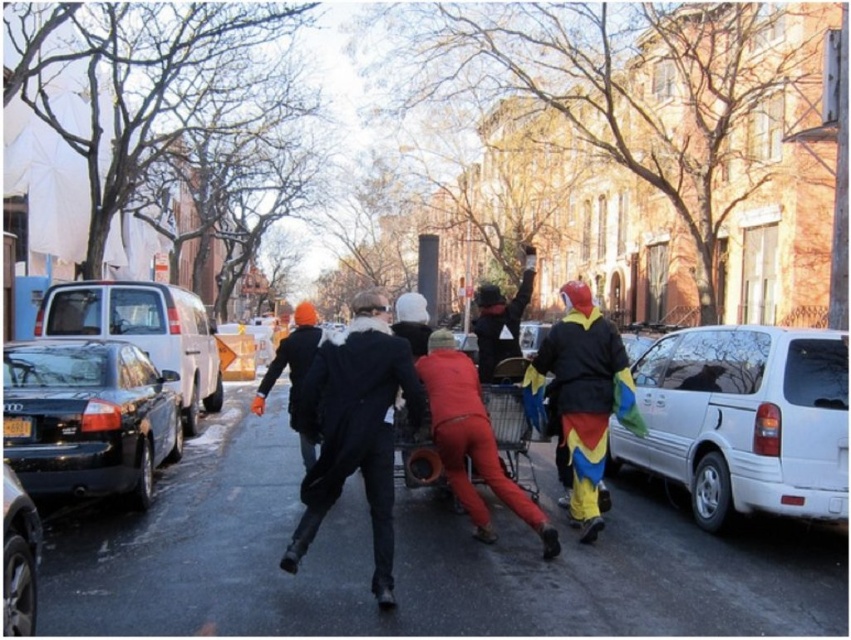
Which of these two, shiny black sedan at left or multicolored fabric pants at right, stands taller?

multicolored fabric pants at right is taller.

Measure the distance between shiny black sedan at left and camera.

shiny black sedan at left is 17.38 feet away from camera.

I want to click on shiny black sedan at left, so click(87, 419).

Consider the image. Is white matte van at right taller than black wool coat at center?

In fact, white matte van at right may be shorter than black wool coat at center.

Which is behind, point (821, 476) or point (390, 406)?

The point (821, 476) is more distant.

The height and width of the screenshot is (640, 851). I want to click on white matte van at right, so click(x=743, y=420).

Measure the distance between white matte van at right and shiny black sedan at left.

A distance of 5.74 meters exists between white matte van at right and shiny black sedan at left.

Does white matte van at right lie in front of shiny black sedan at left?

Yes.

Which is behind, point (694, 410) or point (113, 356)?

Positioned behind is point (113, 356).

Identify the location of white matte van at right. (743, 420).